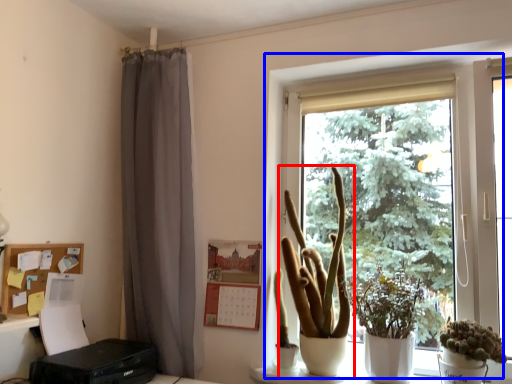
Question: Which of the following is the farthest to the observer, houseplant (highlighted by a red box) or window (highlighted by a blue box)?

Choices:
 (A) houseplant
 (B) window

Answer: (A)